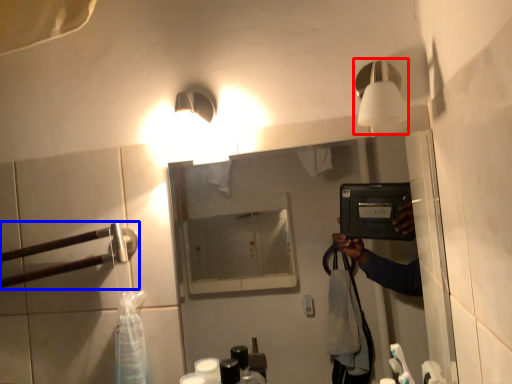
Question: Among these objects, which one is nearest to the camera, light fixture (highlighted by a red box) or door handle (highlighted by a blue box)?

Choices:
 (A) light fixture
 (B) door handle

Answer: (A)